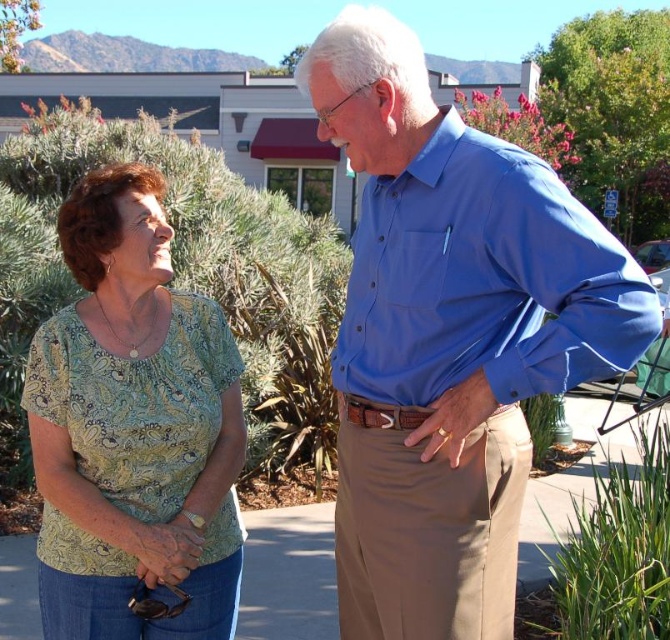
Question: Does blue cotton shirt at center have a smaller size compared to green paisley blouse at left?

Choices:
 (A) yes
 (B) no

Answer: (B)

Question: Among these points, which one is nearest to the camera?

Choices:
 (A) (452, 484)
 (B) (131, 406)

Answer: (A)

Question: Which point is farther to the camera?

Choices:
 (A) 212,452
 (B) 362,289

Answer: (A)

Question: Is blue cotton shirt at center closer to the viewer compared to green paisley blouse at left?

Choices:
 (A) no
 (B) yes

Answer: (B)

Question: Is blue cotton shirt at center positioned in front of green paisley blouse at left?

Choices:
 (A) no
 (B) yes

Answer: (B)

Question: Which object is closer to the camera taking this photo?

Choices:
 (A) blue cotton shirt at center
 (B) green paisley blouse at left

Answer: (A)